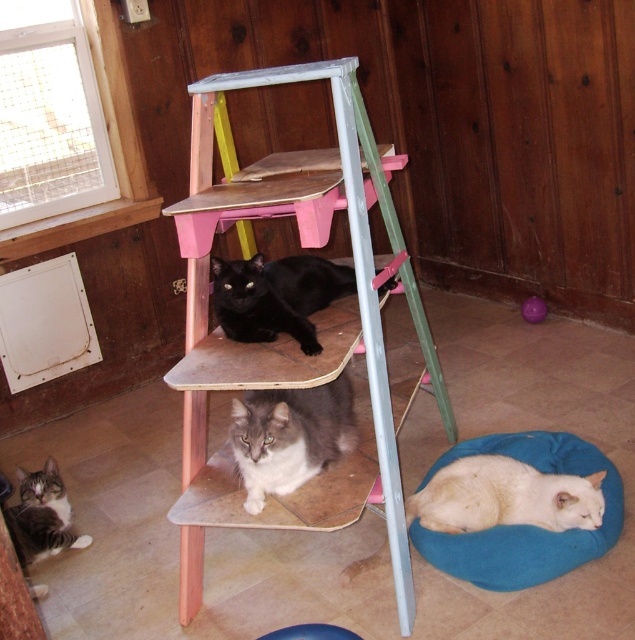
You are standing in front of the cat ladder and want to place a small toy at point (458, 445). If your hand can reach up to 2 meters, can you reach that point?

The distance of point (458, 445) from camera is 2.46 meters, so you cannot reach it with a 2 meter reach.

You are standing in the room and see the cat ladder with three levels. There is a point at coordinates (525, 525). Which object is this point located on?

The point at coordinates (525, 525) is located on the blue fabric dog bed at lower right.

Based on the photo, you are a cat owner who wants to place a new toy on the black matte cat at center. The toy requires a spot that is not occupied by any part of the cat. Based on the coordinates provided, can you place the toy at point (276, 296)?

The point (276, 296) is on the black matte cat at center, so placing the toy there would directly place it on the cat. Choose an alternative location that is not on the cat to avoid disturbing it.